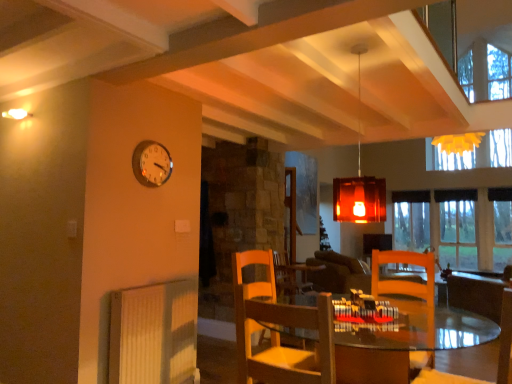
Question: From the image's perspective, is wooden chair at center, the 2th chair positioned from the right, under wooden table at center?

Choices:
 (A) no
 (B) yes

Answer: (A)

Question: Is wooden chair at center, the 2th chair positioned from the right, wider than wooden table at center?

Choices:
 (A) yes
 (B) no

Answer: (B)

Question: Can you confirm if wooden chair at center, the first chair positioned from the left, is taller than wooden table at center?

Choices:
 (A) no
 (B) yes

Answer: (A)

Question: Considering the relative sizes of wooden chair at center, the 2th chair positioned from the right, and wooden table at center in the image provided, is wooden chair at center, the 2th chair positioned from the right, smaller than wooden table at center?

Choices:
 (A) no
 (B) yes

Answer: (B)

Question: Can you confirm if wooden chair at center, the 2th chair positioned from the right, is positioned to the right of wooden table at center?

Choices:
 (A) yes
 (B) no

Answer: (B)

Question: Considering the relative sizes of dark brown leather couch at center and translucent amber glass pendant light at center in the image provided, is dark brown leather couch at center thinner than translucent amber glass pendant light at center?

Choices:
 (A) no
 (B) yes

Answer: (A)

Question: From a real-world perspective, is dark brown leather couch at center over translucent amber glass pendant light at center?

Choices:
 (A) no
 (B) yes

Answer: (A)

Question: From the image's perspective, would you say dark brown leather couch at center is positioned over translucent amber glass pendant light at center?

Choices:
 (A) no
 (B) yes

Answer: (A)

Question: Is dark brown leather couch at center further to the viewer compared to translucent amber glass pendant light at center?

Choices:
 (A) yes
 (B) no

Answer: (A)

Question: From the image's perspective, does dark brown leather couch at center appear lower than translucent amber glass pendant light at center?

Choices:
 (A) yes
 (B) no

Answer: (A)

Question: Is dark brown leather couch at center in front of translucent amber glass pendant light at center?

Choices:
 (A) yes
 (B) no

Answer: (B)

Question: Is wooden chair at lower right, acting as the 1th chair starting from the right, further to camera compared to white ribbed radiator at lower left?

Choices:
 (A) yes
 (B) no

Answer: (B)